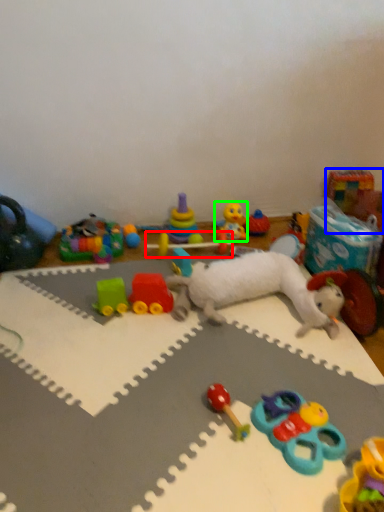
Question: Considering the real-world distances, which object is farthest from toy (highlighted by a red box)? toy (highlighted by a blue box) or toy (highlighted by a green box)?

Choices:
 (A) toy
 (B) toy

Answer: (A)